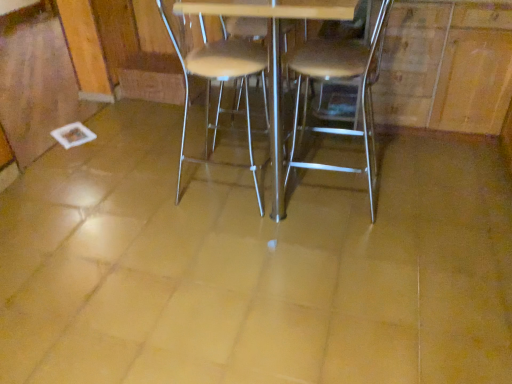
In order to click on free space on the front side of metallic silver table at center in this screenshot , I will do `click(225, 308)`.